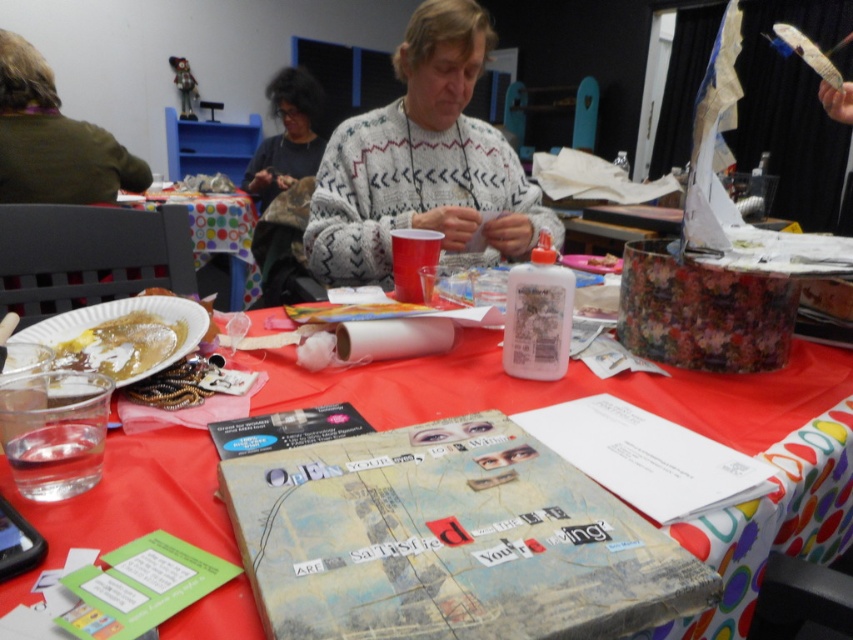
Question: Can you confirm if white knitted sweater at center is positioned above yellowish matte pancake at lower left?

Choices:
 (A) yes
 (B) no

Answer: (A)

Question: Is white knitted sweater at center further to camera compared to red polka dot tablecloth at center?

Choices:
 (A) no
 (B) yes

Answer: (A)

Question: Is textured paper collage at center positioned at the back of brown fuzzy sweater at upper left?

Choices:
 (A) yes
 (B) no

Answer: (B)

Question: Which of these objects is positioned farthest from the red polka dot tablecloth at center?

Choices:
 (A) brown fuzzy sweater at upper left
 (B) white knitted sweater at center

Answer: (B)

Question: Which object appears closest to the camera in this image?

Choices:
 (A) brown fuzzy sweater at upper left
 (B) white knitted sweater at center

Answer: (B)

Question: Which object appears farthest from the camera in this image?

Choices:
 (A) white knitted sweater at center
 (B) yellowish matte pancake at lower left
 (C) brown fuzzy sweater at upper left
 (D) red polka dot tablecloth at center

Answer: (D)